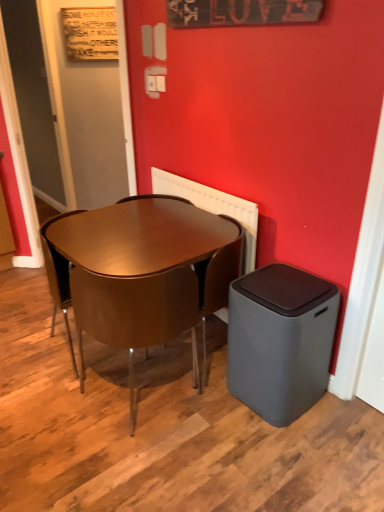
You are a GUI agent. You are given a task and a screenshot of the screen. Output one action in this format:
    pyautogui.click(x=<x>, y=<y>)
    Task: Click on the vacant area located to the right-hand side of brown leather chair at center, marked as the 2th chair in a right-to-left arrangement
    The height and width of the screenshot is (512, 384).
    Given the screenshot: What is the action you would take?
    pyautogui.click(x=224, y=418)